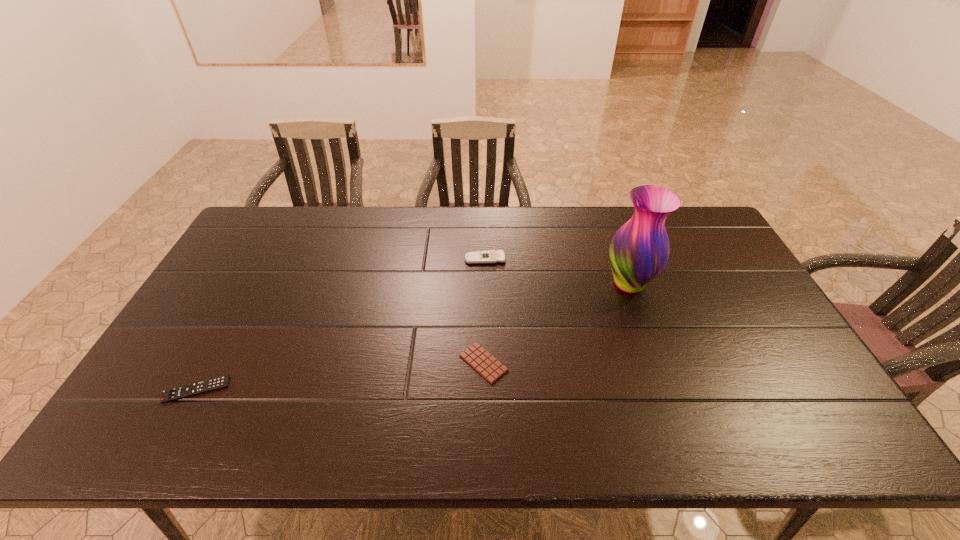
Identify the location of the tallest object. The width and height of the screenshot is (960, 540). (639, 250).

The height and width of the screenshot is (540, 960). Find the location of `the second farthest object`. the second farthest object is located at coordinates (639, 250).

At what (x,y) coordinates should I click in order to perform the action: click on the farther remote control. Please return your answer as a coordinate pair (x, y). Image resolution: width=960 pixels, height=540 pixels. Looking at the image, I should click on (490, 256).

The image size is (960, 540). In order to click on the right remote control in this screenshot , I will do `click(490, 256)`.

The image size is (960, 540). Find the location of `the nearer remote control`. the nearer remote control is located at coordinates (184, 391).

I want to click on the shorter remote control, so [x=184, y=391].

The width and height of the screenshot is (960, 540). I want to click on candy bar, so click(x=484, y=363).

Find the location of a particular element. This screenshot has width=960, height=540. free point located 0.340m on the front of the vase is located at coordinates (672, 408).

Identify the location of vacant space located 0.370m on the front of the right remote control. The width and height of the screenshot is (960, 540). coord(486,359).

At what (x,y) coordinates should I click in order to perform the action: click on free spot located 0.050m on the left of the leftmost object. Please return your answer as a coordinate pair (x, y). The height and width of the screenshot is (540, 960). Looking at the image, I should click on (145, 389).